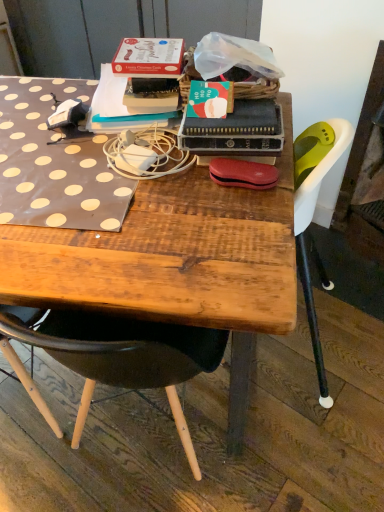
Question: Is hardcover book at center far away from wooden desk at center?

Choices:
 (A) no
 (B) yes

Answer: (A)

Question: Is hardcover book at center closer to the viewer compared to wooden desk at center?

Choices:
 (A) no
 (B) yes

Answer: (A)

Question: Can you confirm if hardcover book at center is thinner than wooden desk at center?

Choices:
 (A) yes
 (B) no

Answer: (A)

Question: Does hardcover book at center appear on the left side of wooden desk at center?

Choices:
 (A) yes
 (B) no

Answer: (B)

Question: Is hardcover book at center not within wooden desk at center?

Choices:
 (A) yes
 (B) no

Answer: (A)

Question: Considering the positions of matte red pouch at center and wooden desk at center in the image, is matte red pouch at center wider or thinner than wooden desk at center?

Choices:
 (A) wide
 (B) thin

Answer: (B)

Question: Is matte red pouch at center to the left or to the right of wooden desk at center in the image?

Choices:
 (A) left
 (B) right

Answer: (B)

Question: Is matte red pouch at center situated inside wooden desk at center or outside?

Choices:
 (A) outside
 (B) inside

Answer: (A)

Question: Considering their positions, is matte red pouch at center located in front of or behind wooden desk at center?

Choices:
 (A) front
 (B) behind

Answer: (B)

Question: Based on their sizes in the image, would you say matte red pouch at center is bigger or smaller than white matte charger at center?

Choices:
 (A) big
 (B) small

Answer: (B)

Question: From a real-world perspective, is matte red pouch at center above or below white matte charger at center?

Choices:
 (A) above
 (B) below

Answer: (A)

Question: Is matte red pouch at center taller or shorter than white matte charger at center?

Choices:
 (A) short
 (B) tall

Answer: (B)

Question: Visually, is matte red pouch at center positioned to the left or to the right of white matte charger at center?

Choices:
 (A) left
 (B) right

Answer: (B)

Question: Considering the relative positions of wooden desk at center and hardcover book at center in the image provided, is wooden desk at center to the left or to the right of hardcover book at center?

Choices:
 (A) right
 (B) left

Answer: (B)

Question: Is wooden desk at center inside or outside of hardcover book at center?

Choices:
 (A) inside
 (B) outside

Answer: (B)